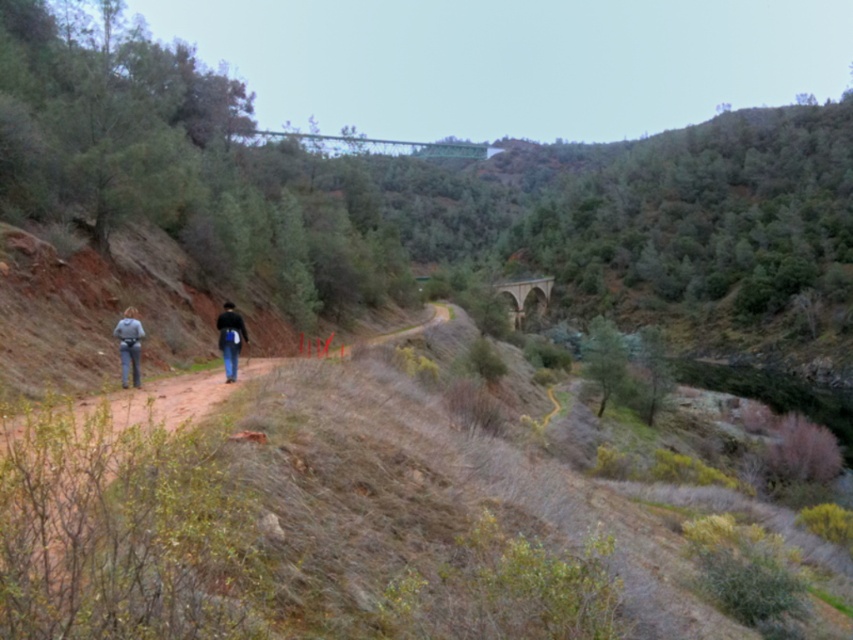
You are a hiker trying to locate your friend who is wearing a dark blue jacket at center. You are wearing dark gray jeans at left. According to the scene, who is closer to the camera between you and your friend?

The dark gray jeans at left is in front of dark blue jacket at center, so you are closer to the camera than your friend wearing the dark blue jacket at center.

You are navigating a hilly terrain with a dirt path and sparse vegetation. You see denim pants at left. Where exactly are the denim pants located in the scene?

The denim pants at left are located at point [129,346].

You are a hiker trying to locate your friend who is wearing a dark blue jacket at center. From your position near the denim pants at left, in which direction should you move to reach your friend?

You should move to the right towards the dark blue jacket at center since the denim pants at left is to the left of dark blue jacket at center.